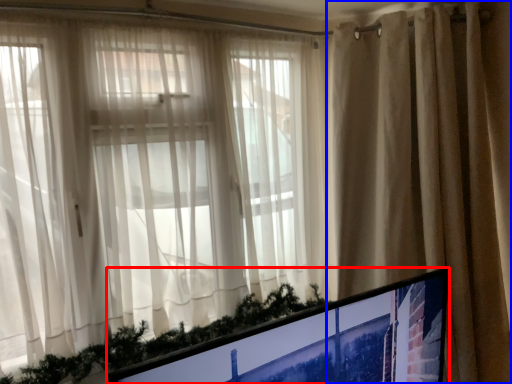
Question: Which object appears farthest to the camera in this image, computer monitor (highlighted by a red box) or curtain (highlighted by a blue box)?

Choices:
 (A) computer monitor
 (B) curtain

Answer: (B)